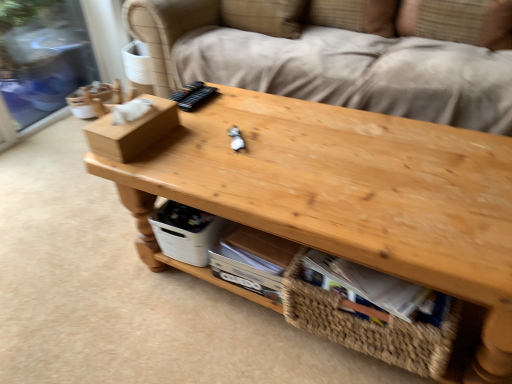
Find the location of `brown cardboard box at left`. brown cardboard box at left is located at coordinates (132, 131).

Describe the element at coordinates (346, 201) in the screenshot. I see `natural wood table at center` at that location.

This screenshot has width=512, height=384. Identify the location of white plastic storage box at lower center. (185, 232).

Image resolution: width=512 pixels, height=384 pixels. What are the coordinates of `brown cardboard box at left` in the screenshot? It's located at (132, 131).

How far apart are brown cardboard box at left and woven straw basket at lower center?

brown cardboard box at left is 27.32 inches away from woven straw basket at lower center.

Identify the location of box lying on the left of woven straw basket at lower center. Image resolution: width=512 pixels, height=384 pixels. pyautogui.click(x=132, y=131).

Which of these two, brown cardboard box at left or woven straw basket at lower center, is smaller?

With smaller size is brown cardboard box at left.

Which object is closer to the camera taking this photo, brown cardboard box at left or woven straw basket at lower center?

woven straw basket at lower center.

Does woven straw basket at lower center have a greater height compared to natural wood table at center?

No.

Between woven straw basket at lower center and natural wood table at center, which one has larger size?

natural wood table at center.

From the image's perspective, does woven straw basket at lower center appear higher than natural wood table at center?

No, from the image's perspective, woven straw basket at lower center is not above natural wood table at center.

Consider the image. How distant is woven straw basket at lower center from natural wood table at center?

woven straw basket at lower center and natural wood table at center are 9.95 inches apart.

Consider the image. Based on their sizes in the image, would you say woven straw basket at lower center is bigger or smaller than white plastic storage box at lower center?

woven straw basket at lower center is bigger than white plastic storage box at lower center.

Between woven straw basket at lower center and white plastic storage box at lower center, which one has more height?

woven straw basket at lower center is taller.

How different are the orientations of woven straw basket at lower center and white plastic storage box at lower center in degrees?

There is a 0.000239-degree angle between the facing directions of woven straw basket at lower center and white plastic storage box at lower center.

Is woven straw basket at lower center oriented towards white plastic storage box at lower center?

No, woven straw basket at lower center is not aimed at white plastic storage box at lower center.

Considering the relative positions of white plastic storage box at lower center and natural wood table at center in the image provided, is white plastic storage box at lower center behind natural wood table at center?

Yes, white plastic storage box at lower center is further from the camera.

Is white plastic storage box at lower center far from natural wood table at center?

They are positioned close to each other.

Which of these two, white plastic storage box at lower center or natural wood table at center, is smaller?

Smaller between the two is white plastic storage box at lower center.

Is natural wood table at center not within woven straw basket at lower center?

Indeed, natural wood table at center is completely outside woven straw basket at lower center.

From the image's perspective, is natural wood table at center under woven straw basket at lower center?

No.

Is natural wood table at center wider or thinner than woven straw basket at lower center?

In the image, natural wood table at center appears to be wider than woven straw basket at lower center.

Which point is more distant from viewer, [223,122] or [431,333]?

The point [223,122] is more distant.

Is brown cardboard box at left taller or shorter than natural wood table at center?

In the image, brown cardboard box at left appears to be shorter than natural wood table at center.

Which object is closer to the camera, brown cardboard box at left or natural wood table at center?

natural wood table at center is closer to the camera.

Does brown cardboard box at left turn towards natural wood table at center?

No, brown cardboard box at left is not aimed at natural wood table at center.

At what (x,y) coordinates should I click in order to perform the action: click on table that appears on the right of brown cardboard box at left. Please return your answer as a coordinate pair (x, y). The width and height of the screenshot is (512, 384). Looking at the image, I should click on (346, 201).

How different are the orientations of woven straw basket at lower center and brown cardboard box at left in degrees?

There is a 3.12-degree angle between the facing directions of woven straw basket at lower center and brown cardboard box at left.

From the image's perspective, is woven straw basket at lower center above brown cardboard box at left?

No, from the image's perspective, woven straw basket at lower center is not on top of brown cardboard box at left.

Could you tell me if woven straw basket at lower center is facing brown cardboard box at left?

No, woven straw basket at lower center is not turned towards brown cardboard box at left.

Who is taller, woven straw basket at lower center or brown cardboard box at left?

woven straw basket at lower center.

Identify the location of basket beneath the brown cardboard box at left (from a real-world perspective). (368, 326).

Find the location of `basket that appears below the natural wood table at center (from the image's perspective)`. basket that appears below the natural wood table at center (from the image's perspective) is located at coordinates (368, 326).

When comparing their distances from woven straw basket at lower center, does natural wood table at center or white plastic storage box at lower center seem further?

white plastic storage box at lower center lies further to woven straw basket at lower center than the other object.

When comparing their distances from natural wood table at center, does white plastic storage box at lower center or woven straw basket at lower center seem further?

white plastic storage box at lower center is further to natural wood table at center.

From the image, which object appears to be nearer to woven straw basket at lower center, brown cardboard box at left or white plastic storage box at lower center?

white plastic storage box at lower center lies closer to woven straw basket at lower center than the other object.

Considering their positions, is natural wood table at center positioned closer to brown cardboard box at left than white plastic storage box at lower center?

Among the two, white plastic storage box at lower center is located nearer to brown cardboard box at left.

Based on their spatial positions, is white plastic storage box at lower center or woven straw basket at lower center closer to brown cardboard box at left?

white plastic storage box at lower center lies closer to brown cardboard box at left than the other object.

Considering their positions, is white plastic storage box at lower center positioned closer to woven straw basket at lower center than natural wood table at center?

natural wood table at center lies closer to woven straw basket at lower center than the other object.

From the picture: Which object lies nearer to the anchor point woven straw basket at lower center, natural wood table at center or brown cardboard box at left?

natural wood table at center is positioned closer to the anchor woven straw basket at lower center.

Looking at the image, which one is located closer to white plastic storage box at lower center, woven straw basket at lower center or natural wood table at center?

Based on the image, natural wood table at center appears to be nearer to white plastic storage box at lower center.

Locate an element on the screen. basket between natural wood table at center and white plastic storage box at lower center in the front-back direction is located at coordinates (368, 326).

In order to click on table between brown cardboard box at left and woven straw basket at lower center from left to right in this screenshot , I will do `click(346, 201)`.

This screenshot has width=512, height=384. What are the coordinates of `box positioned between natural wood table at center and white plastic storage box at lower center from near to far` in the screenshot? It's located at (132, 131).

Locate an element on the screen. The height and width of the screenshot is (384, 512). storage box between brown cardboard box at left and woven straw basket at lower center from left to right is located at coordinates (185, 232).